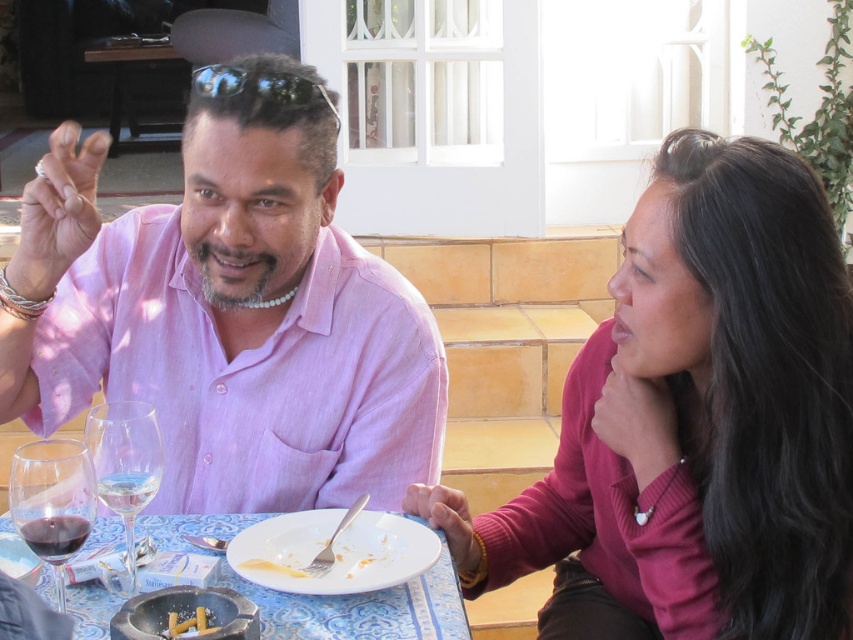
Is white matte plate at center shorter than black reflective sunglasses at upper center?

Indeed, white matte plate at center has a lesser height compared to black reflective sunglasses at upper center.

The image size is (853, 640). Identify the location of white matte plate at center. (334, 552).

This screenshot has height=640, width=853. Identify the location of clear glass wine glass at lower left. (125, 464).

Between clear glass wine glass at lower left and black reflective sunglasses at upper center, which one is positioned lower?

Positioned lower is clear glass wine glass at lower left.

Identify the location of clear glass wine glass at lower left. (125, 464).

Is pink linen shirt at center bigger than charred wood skewers at center?

Yes.

Where is `pink linen shirt at center`? The width and height of the screenshot is (853, 640). pink linen shirt at center is located at coordinates (228, 310).